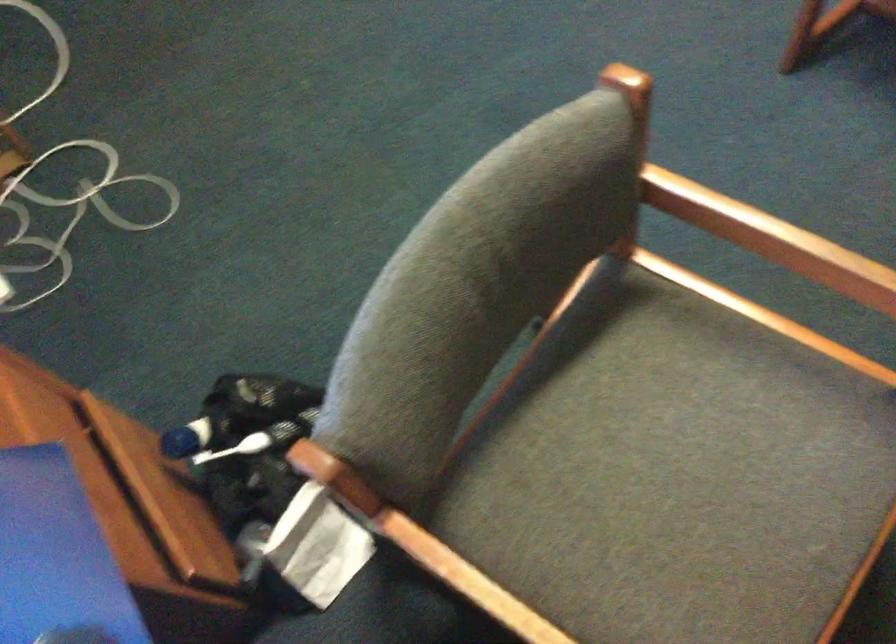
At what (x,y) coordinates should I click in order to perform the action: click on chair sitting surface. Please return your answer as a coordinate pair (x, y). This screenshot has width=896, height=644. Looking at the image, I should click on (643, 444).